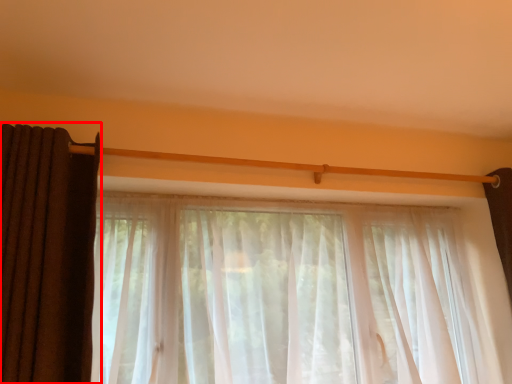
Question: From the image, what is the correct spatial relationship of curtain (annotated by the red box) in relation to curtain?

Choices:
 (A) right
 (B) left

Answer: (B)